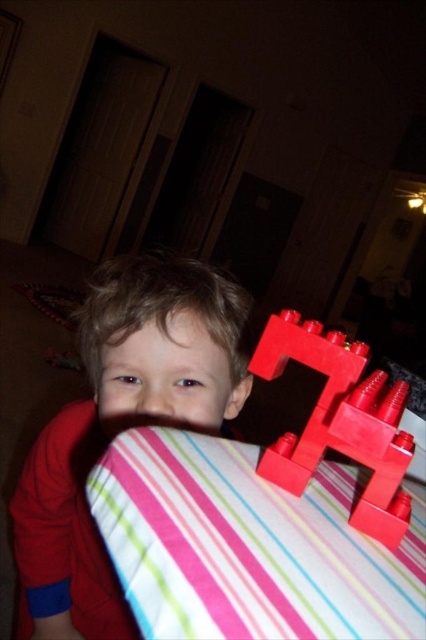
Is matte red toy at center smaller than matte plastic toy at right?

Incorrect, matte red toy at center is not smaller in size than matte plastic toy at right.

Measure the distance between point [104,392] and camera.

They are 23.28 inches apart.

Is point (14, 522) positioned after point (356, 422)?

Yes, point (14, 522) is behind point (356, 422).

Image resolution: width=426 pixels, height=640 pixels. What are the coordinates of `matte red toy at center` in the screenshot? It's located at (120, 428).